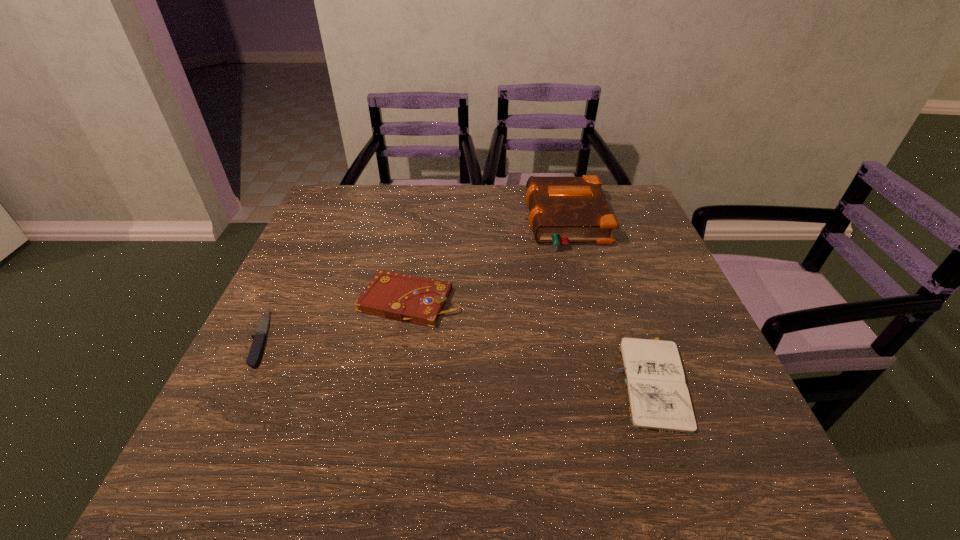
Locate an element on the screen. The width and height of the screenshot is (960, 540). Bible is located at coordinates (563, 210).

Image resolution: width=960 pixels, height=540 pixels. Identify the location of the tallest object. (563, 210).

Image resolution: width=960 pixels, height=540 pixels. I want to click on the second object from left to right, so click(x=402, y=297).

In order to click on the farther notebook in this screenshot , I will do `click(402, 297)`.

Image resolution: width=960 pixels, height=540 pixels. Identify the location of the right notebook. click(x=658, y=397).

Image resolution: width=960 pixels, height=540 pixels. In order to click on the nearer notebook in this screenshot , I will do `click(658, 397)`.

The height and width of the screenshot is (540, 960). I want to click on steak knife, so click(259, 339).

The width and height of the screenshot is (960, 540). I want to click on the shortest object, so (259, 339).

Find the location of a particular element. The width and height of the screenshot is (960, 540). blank space located on the spine side of the farthest object is located at coordinates (495, 222).

Identify the location of vacant space situated 0.140m on the spine side of the farthest object. (478, 222).